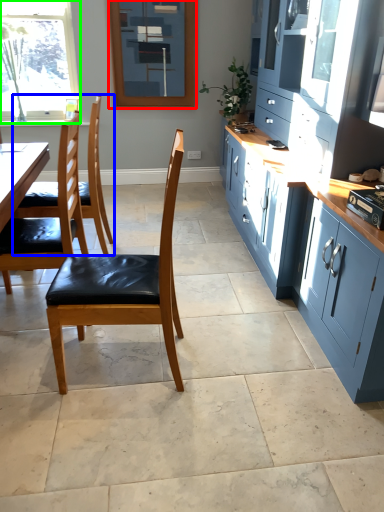
Question: Which is nearer to the window screen (highlighted by a red box)? chair (highlighted by a blue box) or window (highlighted by a green box).

Choices:
 (A) chair
 (B) window

Answer: (B)